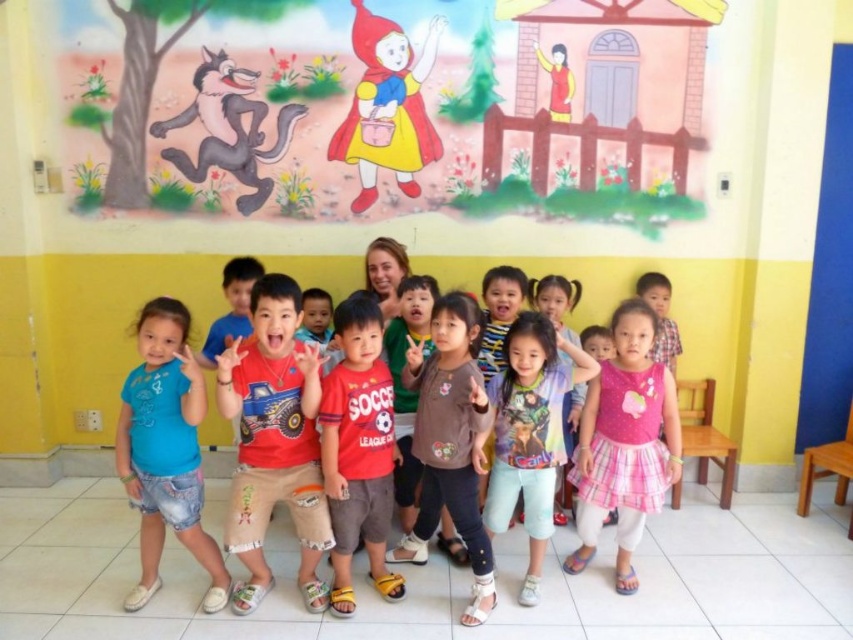
Does reddish-orange t-shirt at center lie in front of pink plaid dress at center?

Yes, reddish-orange t-shirt at center is in front of pink plaid dress at center.

Does reddish-orange t-shirt at center have a larger size compared to pink plaid dress at center?

Correct, reddish-orange t-shirt at center is larger in size than pink plaid dress at center.

Identify the location of reddish-orange t-shirt at center. This screenshot has width=853, height=640. (453, 444).

In order to click on reddish-orange t-shirt at center in this screenshot , I will do click(453, 444).

Is pink plaid dress at center shorter than brown cotton shirt at center?

Correct, pink plaid dress at center is not as tall as brown cotton shirt at center.

Is pink plaid dress at center to the left of brown cotton shirt at center from the viewer's perspective?

Incorrect, pink plaid dress at center is not on the left side of brown cotton shirt at center.

The image size is (853, 640). What are the coordinates of `pink plaid dress at center` in the screenshot? It's located at (625, 442).

Looking at this image, does reddish-orange t-shirt at center appear on the right side of reddish-orange cotton t-shirt at center?

Correct, you'll find reddish-orange t-shirt at center to the right of reddish-orange cotton t-shirt at center.

Between reddish-orange t-shirt at center and reddish-orange cotton t-shirt at center, which one is positioned higher?

Positioned higher is reddish-orange cotton t-shirt at center.

In order to click on reddish-orange t-shirt at center in this screenshot , I will do `click(453, 444)`.